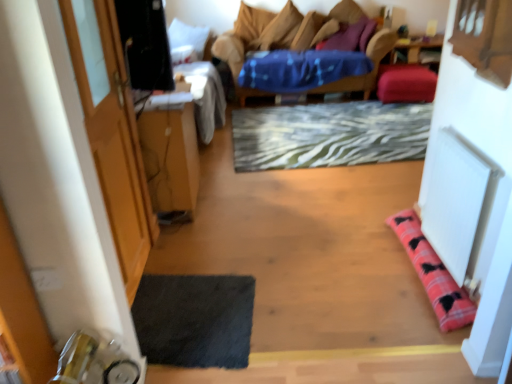
Where is `pink plaid pillow at lower right, acting as the 1th pillow starting from the bottom`? The width and height of the screenshot is (512, 384). pink plaid pillow at lower right, acting as the 1th pillow starting from the bottom is located at coordinates (433, 273).

What is the approximate height of dark gray textured yoga mat at lower left?

dark gray textured yoga mat at lower left is 4.28 centimeters tall.

What do you see at coordinates (195, 320) in the screenshot? I see `dark gray textured yoga mat at lower left` at bounding box center [195, 320].

Where is `wooden table at left`? wooden table at left is located at coordinates (170, 152).

The image size is (512, 384). What do you see at coordinates (329, 135) in the screenshot?
I see `zebra-patterned rug at center` at bounding box center [329, 135].

At what (x,y) coordinates should I click in order to perform the action: click on velvet blue studio couch at center. Please return your answer as a coordinate pair (x, y). This screenshot has width=512, height=384. Looking at the image, I should click on (469, 117).

Is velvet pink cushion at upper right, the fourth pillow viewed from the left, oriented towards wooden armchair at upper center?

No, velvet pink cushion at upper right, the fourth pillow viewed from the left, is not aimed at wooden armchair at upper center.

Consider the image. Does velvet pink cushion at upper right, which appears as the 2th pillow when ordered from the bottom, have a lesser height compared to wooden armchair at upper center?

Yes.

Which is correct: velvet pink cushion at upper right, which ranks as the 3th pillow in top-to-bottom order, is inside wooden armchair at upper center, or outside of it?

velvet pink cushion at upper right, which ranks as the 3th pillow in top-to-bottom order, is located beyond the bounds of wooden armchair at upper center.

Visually, is velvet pink cushion at upper right, the fourth pillow viewed from the left, positioned to the left or to the right of wooden armchair at upper center?

Clearly, velvet pink cushion at upper right, the fourth pillow viewed from the left, is on the right of wooden armchair at upper center in the image.

Which object is positioned more to the right, wooden door at left or zebra-patterned rug at center?

Positioned to the right is zebra-patterned rug at center.

In the scene shown: Is wooden door at left facing towards zebra-patterned rug at center?

No, wooden door at left is not facing towards zebra-patterned rug at center.

Does wooden door at left have a lesser height compared to zebra-patterned rug at center?

In fact, wooden door at left may be taller than zebra-patterned rug at center.

Considering the positions of point (134, 205) and point (408, 112), is point (134, 205) closer or farther from the camera than point (408, 112)?

Point (134, 205) appears to be closer to the viewer than point (408, 112).

Which of these two, dark gray textured yoga mat at lower left or white fabric pillow at upper left, which ranks as the fourth pillow in right-to-left order, stands shorter?

With less height is dark gray textured yoga mat at lower left.

Between dark gray textured yoga mat at lower left and white fabric pillow at upper left, the 2th pillow positioned from the top, which one has larger width?

dark gray textured yoga mat at lower left is wider.

From the image's perspective, which is below, dark gray textured yoga mat at lower left or white fabric pillow at upper left, which ranks as the fourth pillow in right-to-left order?

dark gray textured yoga mat at lower left, from the image's perspective.

From a real-world perspective, which object stands above the other?

white fabric pillow at upper left, marked as the third pillow in a back-to-front arrangement.

Is wooden armchair at upper center located within dark gray textured yoga mat at lower left?

No, wooden armchair at upper center is not surrounded by dark gray textured yoga mat at lower left.

Is dark gray textured yoga mat at lower left to the right of wooden armchair at upper center from the viewer's perspective?

No, dark gray textured yoga mat at lower left is not to the right of wooden armchair at upper center.

Would you consider dark gray textured yoga mat at lower left to be distant from wooden armchair at upper center?

Indeed, dark gray textured yoga mat at lower left is not near wooden armchair at upper center.

From a real-world perspective, which is physically above, dark gray textured yoga mat at lower left or wooden armchair at upper center?

From a 3D spatial view, wooden armchair at upper center is above.

From a real-world perspective, which is physically below, white fabric pillow at upper left, which ranks as the fourth pillow in right-to-left order, or dark gray textured yoga mat at lower left?

dark gray textured yoga mat at lower left is physically lower.

Considering the positions of objects white fabric pillow at upper left, the second pillow in the front-to-back sequence, and dark gray textured yoga mat at lower left in the image provided, who is more to the right, white fabric pillow at upper left, the second pillow in the front-to-back sequence, or dark gray textured yoga mat at lower left?

Positioned to the right is dark gray textured yoga mat at lower left.

Is point (186, 43) positioned in front of point (189, 309)?

No.

Based on the photo, is white fabric pillow at upper left, which ranks as the fourth pillow in right-to-left order, far away from dark gray textured yoga mat at lower left?

Absolutely, white fabric pillow at upper left, which ranks as the fourth pillow in right-to-left order, is distant from dark gray textured yoga mat at lower left.

You are a GUI agent. You are given a task and a screenshot of the screen. Output one action in this format:
    pyautogui.click(x=<x>, y=<y>)
    Task: Click on the table on the left of pink plaid pillow at lower right, placed as the 2th pillow when sorted from left to right
    This screenshot has height=384, width=512.
    Given the screenshot: What is the action you would take?
    pyautogui.click(x=170, y=152)

Considering the points (412, 232) and (183, 200), which point is behind, point (412, 232) or point (183, 200)?

The point (183, 200) is more distant.

Is pink plaid pillow at lower right, which is counted as the first pillow, starting from the front, thinner than wooden table at left?

Yes, pink plaid pillow at lower right, which is counted as the first pillow, starting from the front, is thinner than wooden table at left.

Based on the photo, how many degrees apart are the facing directions of pink plaid pillow at lower right, positioned as the 4th pillow in back-to-front order, and wooden table at left?

87.8 degrees separate the facing orientations of pink plaid pillow at lower right, positioned as the 4th pillow in back-to-front order, and wooden table at left.

From the image's perspective, is wooden table at left located above pink plaid pillow at lower right, the 3th pillow positioned from the right?

Yes, from the image's perspective, wooden table at left is above pink plaid pillow at lower right, the 3th pillow positioned from the right.

Is point (149, 192) farther from camera compared to point (406, 247)?

Yes.

Are wooden table at left and pink plaid pillow at lower right, acting as the 1th pillow starting from the bottom, far apart?

Indeed, wooden table at left is not near pink plaid pillow at lower right, acting as the 1th pillow starting from the bottom.

Is wooden table at left bigger than pink plaid pillow at lower right, which is counted as the first pillow, starting from the front?

Yes, wooden table at left is bigger than pink plaid pillow at lower right, which is counted as the first pillow, starting from the front.

At what (x,y) coordinates should I click in order to perform the action: click on furniture on the left of velvet pink cushion at upper right, the fourth pillow viewed from the left. Please return your answer as a coordinate pair (x, y). Image resolution: width=512 pixels, height=384 pixels. Looking at the image, I should click on (262, 35).

Locate an element on the screen. The height and width of the screenshot is (384, 512). doormat below the wooden door at left (from a real-world perspective) is located at coordinates (329, 135).

Considering their positions, is wooden table at left positioned closer to zebra-patterned rug at center than wooden armchair at upper center?

Among the two, wooden armchair at upper center is located nearer to zebra-patterned rug at center.

Considering their positions, is velvet pink cushion at upper right, which is the 4th pillow from front to back, positioned further to wooden table at left than pink plaid pillow at lower right, positioned as the 4th pillow in back-to-front order?

velvet pink cushion at upper right, which is the 4th pillow from front to back.

From the image, which object appears to be nearer to wooden armchair at upper center, dark gray textured yoga mat at lower left or velvet blue studio couch at center?

velvet blue studio couch at center is positioned closer to the anchor wooden armchair at upper center.

Which object lies further to the anchor point wooden door at left, white fabric pillow at upper left, the 2th pillow positioned from the top, or pink plaid pillow at lower right, placed as the 2th pillow when sorted from left to right?

Among the two, white fabric pillow at upper left, the 2th pillow positioned from the top, is located further to wooden door at left.

Which object lies nearer to the anchor point dark gray textured yoga mat at lower left, purple soft pillow at upper center, the fourth pillow ordered from the bottom, or velvet pink cushion at upper right, which is the 4th pillow from front to back?

velvet pink cushion at upper right, which is the 4th pillow from front to back, is closer to dark gray textured yoga mat at lower left.

When comparing their distances from zebra-patterned rug at center, does white fabric pillow at upper left, which ranks as the fourth pillow in right-to-left order, or purple soft pillow at upper center, acting as the second pillow starting from the back, seem closer?

Based on the image, purple soft pillow at upper center, acting as the second pillow starting from the back, appears to be nearer to zebra-patterned rug at center.

When comparing their distances from velvet pink cushion at upper right, the fourth pillow viewed from the left, does wooden door at left or wooden armchair at upper center seem closer?

wooden armchair at upper center.

Based on their spatial positions, is velvet blue studio couch at center or wooden table at left further from velvet pink cushion at upper right, the 1th pillow in the back-to-front sequence?

The object further to velvet pink cushion at upper right, the 1th pillow in the back-to-front sequence, is wooden table at left.

This screenshot has height=384, width=512. I want to click on yoga mat located between velvet blue studio couch at center and white fabric pillow at upper left, the second pillow in the front-to-back sequence, in the depth direction, so click(195, 320).

Where is `furniture between velvet blue studio couch at center and velvet pink cushion at upper right, the fourth pillow viewed from the left, along the z-axis`? Image resolution: width=512 pixels, height=384 pixels. furniture between velvet blue studio couch at center and velvet pink cushion at upper right, the fourth pillow viewed from the left, along the z-axis is located at coordinates (262, 35).

Locate an element on the screen. The width and height of the screenshot is (512, 384). table between wooden door at left and velvet blue studio couch at center from left to right is located at coordinates (170, 152).

Find the location of a particular element. This screenshot has height=384, width=512. doormat between wooden table at left and pink plaid pillow at lower right, placed as the 2th pillow when sorted from left to right, from left to right is located at coordinates (329, 135).